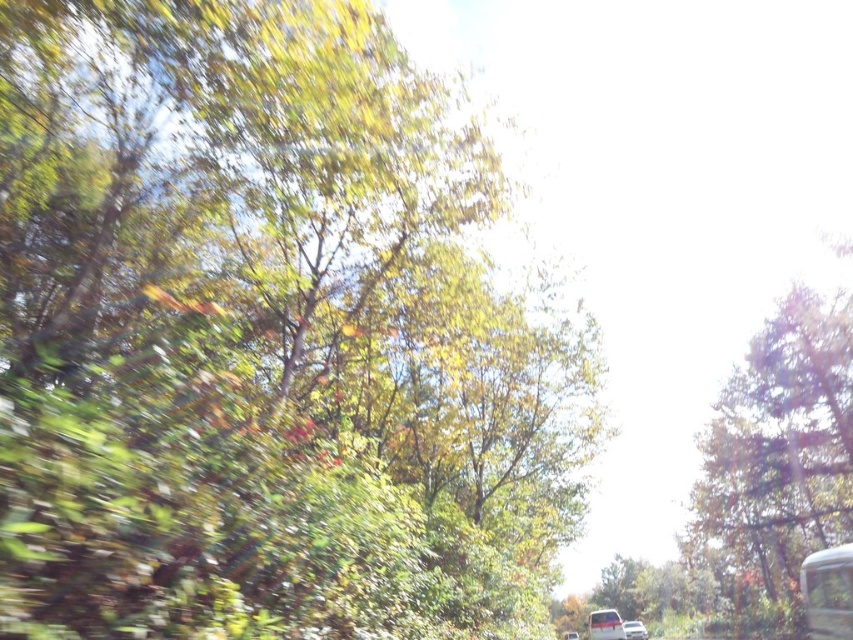
You are a passenger in a moving vehicle and notice a green leafy tree at upper left outside the window. If you want to touch the tree with your hand, which is about 1 foot long, can you reach it from your current position?

The green leafy tree at upper left is 5.32 feet away from you. Since your hand is only 1 foot long, you cannot reach the tree from your current position.

You are a passenger in the vehicle and notice two trees outside the window. The green leafy tree at upper left and the green leafy tree at right. Which tree appears closer to the vehicle based on their sizes?

The green leafy tree at upper left appears closer to the vehicle because it is smaller than the green leafy tree at right, which is larger and therefore farther away.

You are a passenger in the white matte car at lower center. Looking out the window, you notice the green leafy tree at upper left outside. Based on the scene, can you determine if the tree is taller than the car?

The green leafy tree at upper left is taller than the white matte car at lower center according to the description.